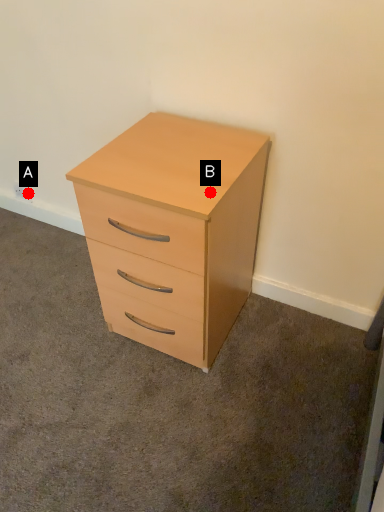
Question: Two points are circled on the image, labeled by A and B beside each circle. Which point is closer to the camera?

Choices:
 (A) A is closer
 (B) B is closer

Answer: (B)